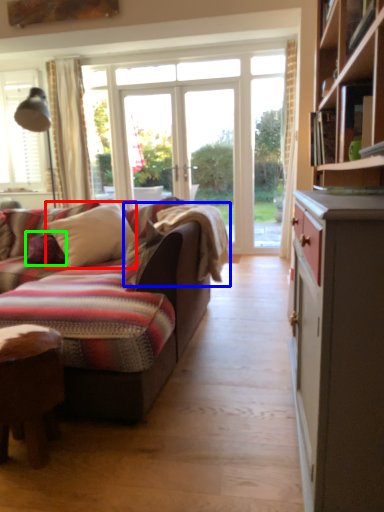
Question: Based on their relative distances, which object is farther from pillow (highlighted by a red box)? Choose from blanket (highlighted by a blue box) and pillow (highlighted by a green box).

Choices:
 (A) blanket
 (B) pillow

Answer: (A)